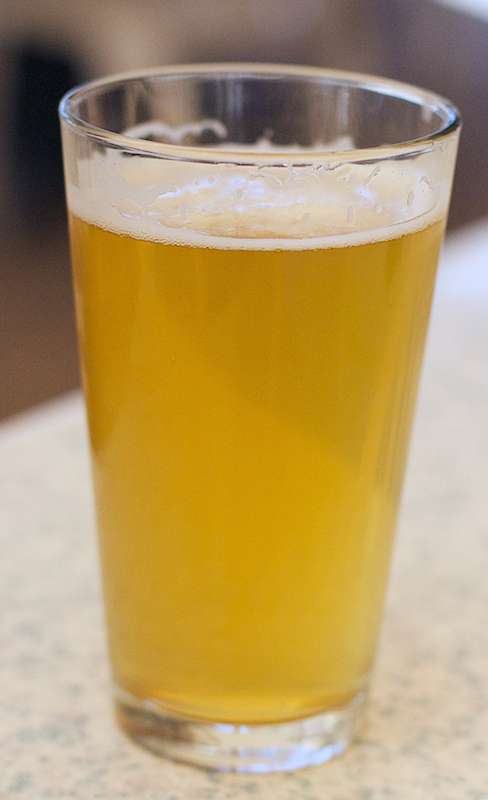
Identify the location of front rim of drinking glass. The height and width of the screenshot is (800, 488). (344, 154), (175, 152).